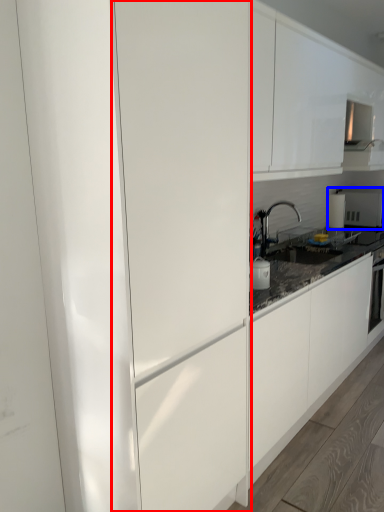
Question: Among these objects, which one is farthest to the camera, glass door (highlighted by a red box) or appliance (highlighted by a blue box)?

Choices:
 (A) glass door
 (B) appliance

Answer: (B)